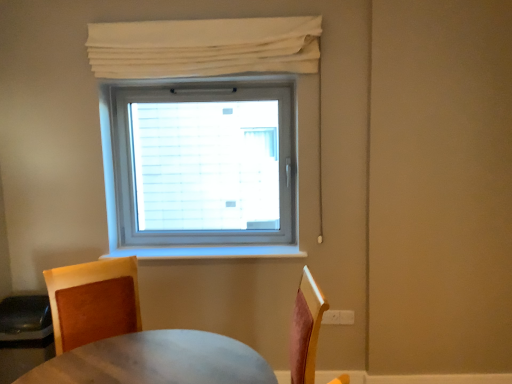
Question: From the image's perspective, relative to brown leather chair at lower left, is white fabric curtain at upper center above or below?

Choices:
 (A) below
 (B) above

Answer: (B)

Question: Is white fabric curtain at upper center spatially inside brown leather chair at lower left, or outside of it?

Choices:
 (A) inside
 (B) outside

Answer: (B)

Question: Considering the relative positions of white fabric curtain at upper center and brown leather chair at lower left in the image provided, is white fabric curtain at upper center to the left or to the right of brown leather chair at lower left?

Choices:
 (A) left
 (B) right

Answer: (B)

Question: In terms of height, does brown leather chair at lower left look taller or shorter compared to white fabric curtain at upper center?

Choices:
 (A) short
 (B) tall

Answer: (B)

Question: Is point (124, 258) positioned closer to the camera than point (136, 51)?

Choices:
 (A) farther
 (B) closer

Answer: (A)

Question: Which is correct: brown leather chair at lower left is inside white fabric curtain at upper center, or outside of it?

Choices:
 (A) outside
 (B) inside

Answer: (A)

Question: From a real-world perspective, is brown leather chair at lower left positioned above or below white fabric curtain at upper center?

Choices:
 (A) above
 (B) below

Answer: (B)